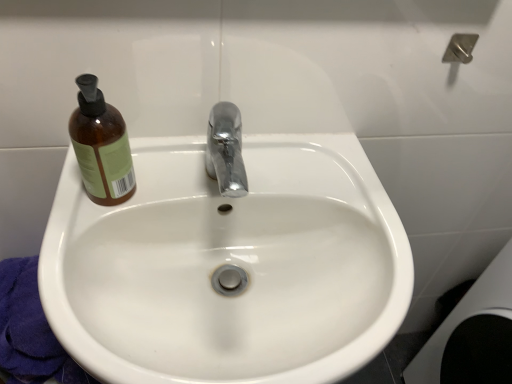
At what (x,y) coordinates should I click in order to perform the action: click on white glossy sink at center. Please return your answer as a coordinate pair (x, y). The height and width of the screenshot is (384, 512). Looking at the image, I should click on (229, 266).

From the picture: What is the approximate height of white glossy sink at center?

The height of white glossy sink at center is 15.63 centimeters.

What do you see at coordinates (229, 266) in the screenshot? This screenshot has width=512, height=384. I see `white glossy sink at center` at bounding box center [229, 266].

The width and height of the screenshot is (512, 384). What are the coordinates of `brown glass bottle at upper left` in the screenshot? It's located at (101, 146).

This screenshot has width=512, height=384. What do you see at coordinates (101, 146) in the screenshot? I see `brown glass bottle at upper left` at bounding box center [101, 146].

Measure the distance between point (85, 120) and camera.

Point (85, 120) is 22.09 inches away from camera.

The image size is (512, 384). What are the coordinates of `white glossy sink at center` in the screenshot? It's located at (229, 266).

Is brown glass bottle at upper left to the left or to the right of white glossy sink at center in the image?

In the image, brown glass bottle at upper left appears on the left side of white glossy sink at center.

Is brown glass bottle at upper left in front of or behind white glossy sink at center in the image?

Visually, brown glass bottle at upper left is located behind white glossy sink at center.

Is point (103, 119) farther from camera compared to point (191, 310)?

No.

From the image's perspective, is brown glass bottle at upper left above or below white glossy sink at center?

Based on their image positions, brown glass bottle at upper left is located above white glossy sink at center.

From the picture: From a real-world perspective, relative to white glossy sink at center, is brown glass bottle at upper left vertically above or below?

brown glass bottle at upper left is situated higher than white glossy sink at center in the real world.

Consider the image. Which of these two, brown glass bottle at upper left or white glossy sink at center, is wider?

With larger width is white glossy sink at center.

Does brown glass bottle at upper left have a lesser height compared to white glossy sink at center?

No, brown glass bottle at upper left is not shorter than white glossy sink at center.

Is brown glass bottle at upper left smaller than white glossy sink at center?

Yes.

Which is correct: brown glass bottle at upper left is inside white glossy sink at center, or outside of it?

brown glass bottle at upper left exists outside the volume of white glossy sink at center.

Is there a large distance between brown glass bottle at upper left and white glossy sink at center?

No, brown glass bottle at upper left is not far from white glossy sink at center.

Is brown glass bottle at upper left looking in the opposite direction of white glossy sink at center?

brown glass bottle at upper left does not have its back to white glossy sink at center.

Locate an element on the screen. This screenshot has height=384, width=512. bottle located above the white glossy sink at center (from a real-world perspective) is located at coordinates (101, 146).

From the picture: Considering the relative positions of white glossy sink at center and brown glass bottle at upper left in the image provided, is white glossy sink at center to the right of brown glass bottle at upper left from the viewer's perspective?

Yes.

Is white glossy sink at center positioned in front of brown glass bottle at upper left?

That is True.

Is point (360, 337) closer to viewer compared to point (83, 162)?

Yes, point (360, 337) is closer to viewer.

From the image's perspective, is white glossy sink at center positioned above or below brown glass bottle at upper left?

From the image's perspective, white glossy sink at center appears below brown glass bottle at upper left.

From a real-world perspective, is white glossy sink at center beneath brown glass bottle at upper left?

Yes, from a real-world perspective, white glossy sink at center is below brown glass bottle at upper left.

Is white glossy sink at center wider than brown glass bottle at upper left?

Yes.

Does white glossy sink at center have a lesser height compared to brown glass bottle at upper left?

Indeed, white glossy sink at center has a lesser height compared to brown glass bottle at upper left.

Who is smaller, white glossy sink at center or brown glass bottle at upper left?

Smaller between the two is brown glass bottle at upper left.

Is brown glass bottle at upper left surrounded by white glossy sink at center?

Actually, brown glass bottle at upper left is outside white glossy sink at center.

Is white glossy sink at center next to brown glass bottle at upper left and touching it?

No, white glossy sink at center is not in contact with brown glass bottle at upper left.

Is white glossy sink at center facing towards brown glass bottle at upper left?

No, white glossy sink at center does not turn towards brown glass bottle at upper left.

How many degrees apart are the facing directions of white glossy sink at center and brown glass bottle at upper left?

They differ by 0.000295 degrees in their facing directions.

Measure the distance between white glossy sink at center and brown glass bottle at upper left.

white glossy sink at center and brown glass bottle at upper left are 8.03 inches apart from each other.

Image resolution: width=512 pixels, height=384 pixels. There is a white glossy sink at center. Identify the location of bottle above it (from a real-world perspective). (101, 146).

Find the location of `sink in front of the brown glass bottle at upper left`. sink in front of the brown glass bottle at upper left is located at coordinates (229, 266).

Where is `sink that is under the brown glass bottle at upper left (from a real-world perspective)`? This screenshot has height=384, width=512. sink that is under the brown glass bottle at upper left (from a real-world perspective) is located at coordinates (229, 266).